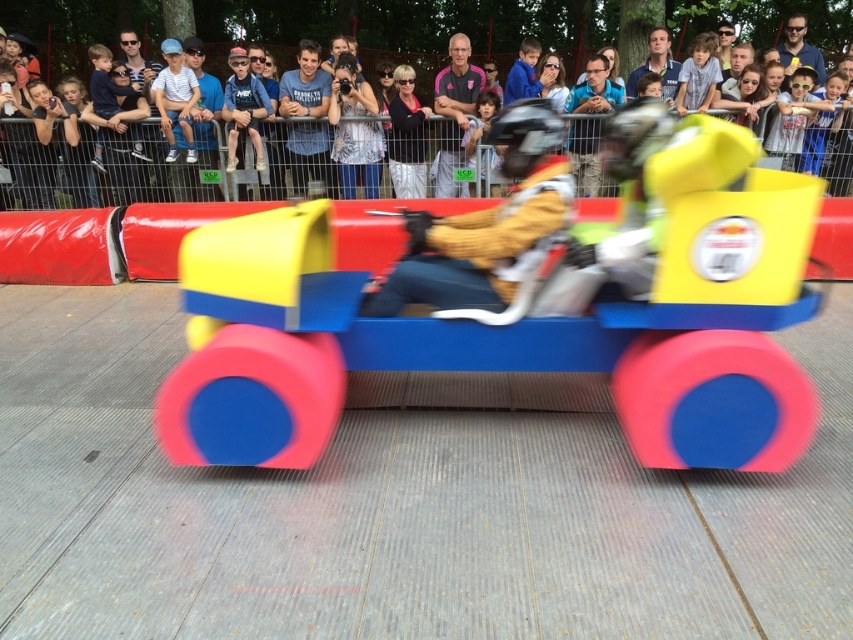
Which is above, matte plastic toy car at center or denim jacket at upper center?

Positioned higher is denim jacket at upper center.

Between matte plastic toy car at center and denim jacket at upper center, which one appears on the right side from the viewer's perspective?

Positioned to the right is matte plastic toy car at center.

Identify the location of matte plastic toy car at center. (521, 305).

Does matte plastic toy car at center appear under yellow matte helmet at center?

Yes, matte plastic toy car at center is below yellow matte helmet at center.

Does matte plastic toy car at center appear on the left side of yellow matte helmet at center?

Correct, you'll find matte plastic toy car at center to the left of yellow matte helmet at center.

I want to click on matte plastic toy car at center, so click(x=521, y=305).

The width and height of the screenshot is (853, 640). What are the coordinates of `matte plastic toy car at center` in the screenshot? It's located at (521, 305).

Between yellow matte helmet at center and denim jacket at upper center, which one is positioned lower?

Positioned lower is yellow matte helmet at center.

Is yellow matte helmet at center below denim jacket at upper center?

Yes, yellow matte helmet at center is below denim jacket at upper center.

Is point (556, 216) farther from viewer compared to point (258, 166)?

That is False.

Find the location of `yellow matte helmet at center`. yellow matte helmet at center is located at coordinates (486, 225).